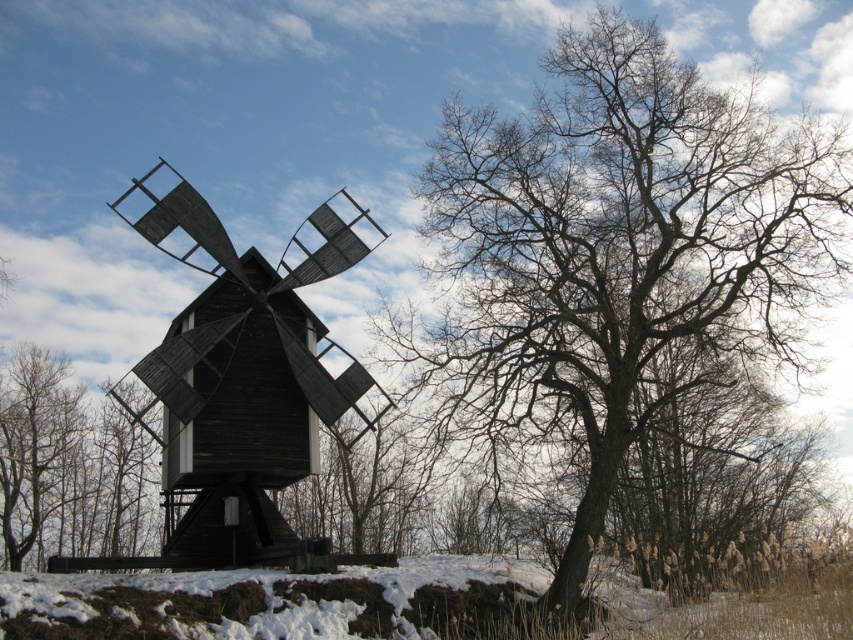
Is bare wood tree at center thinner than dark wood windmill at center?

No, bare wood tree at center is not thinner than dark wood windmill at center.

Does bare wood tree at center come in front of dark wood windmill at center?

No, it is not.

Where is `bare wood tree at center`? bare wood tree at center is located at coordinates (624, 246).

In the scene shown: Between bare wood tree at center and brown wood tree at left, which one appears on the left side from the viewer's perspective?

brown wood tree at left

Where is `bare wood tree at center`? bare wood tree at center is located at coordinates (624, 246).

Where is `bare wood tree at center`? The height and width of the screenshot is (640, 853). bare wood tree at center is located at coordinates (624, 246).

Locate an element on the screen. Image resolution: width=853 pixels, height=640 pixels. bare wood tree at center is located at coordinates (624, 246).

Is dark wood windmill at center to the right of brown wood tree at left from the viewer's perspective?

Correct, you'll find dark wood windmill at center to the right of brown wood tree at left.

What do you see at coordinates (242, 385) in the screenshot? I see `dark wood windmill at center` at bounding box center [242, 385].

The height and width of the screenshot is (640, 853). Identify the location of dark wood windmill at center. (242, 385).